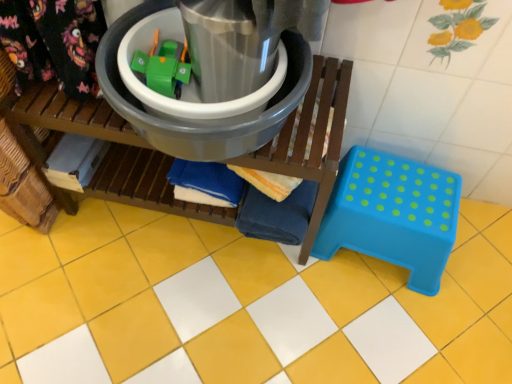
This screenshot has width=512, height=384. In order to click on free spot above blue plastic step stool at lower right (from a real-world perspective) in this screenshot , I will do `click(399, 199)`.